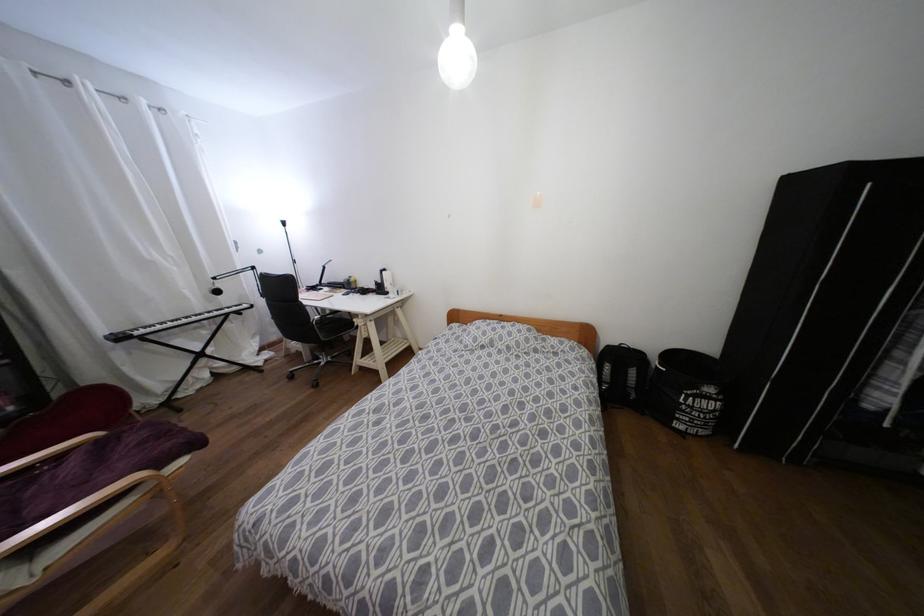
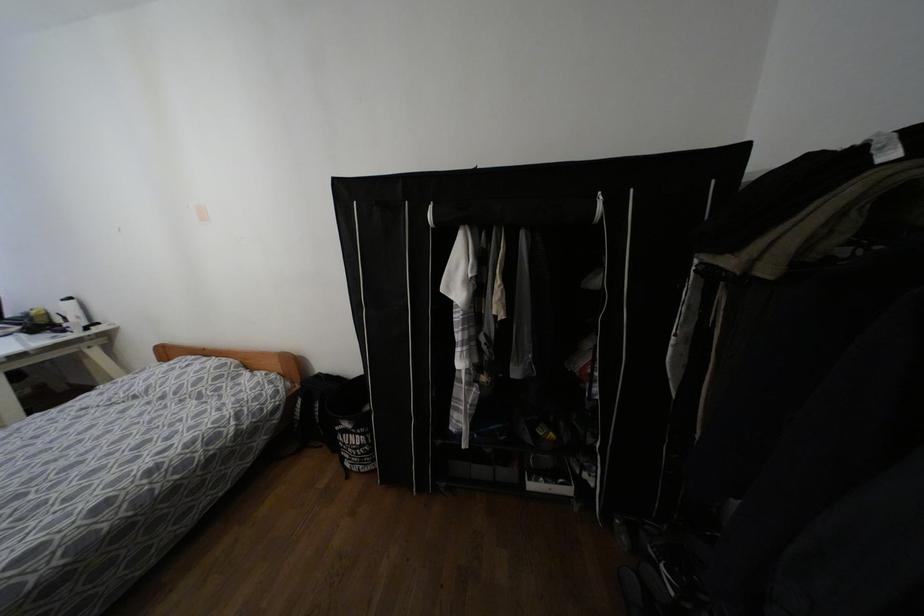
In the second image, find the point that corresponds to the point at 383,270 in the first image.

(68, 299)